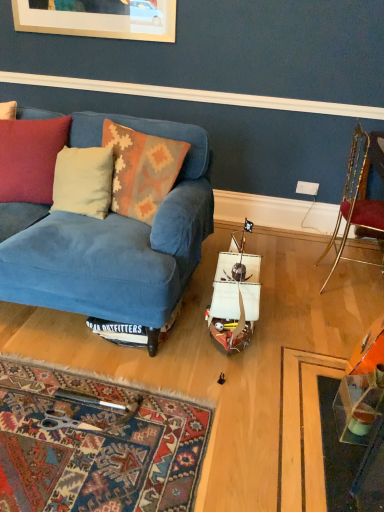
Question: Is velvet cushion at left taller or shorter than white plastic power outlet at center?

Choices:
 (A) tall
 (B) short

Answer: (A)

Question: Is velvet cushion at left inside the boundaries of white plastic power outlet at center, or outside?

Choices:
 (A) outside
 (B) inside

Answer: (A)

Question: Which of these objects is positioned farthest from the transparent plastic table at lower right?

Choices:
 (A) knitted wool pillow at center, acting as the 1th pillow starting from the right
 (B) blue velvet couch at center
 (C) beige fabric pillow at left, which ranks as the 2th pillow in right-to-left order
 (D) white plastic power outlet at center
 (E) gold metallic chair at right

Answer: (D)

Question: Which object is the closest to the knitted wool pillow at center, which is counted as the 2th pillow, starting from the left?

Choices:
 (A) beige fabric pillow at left, which ranks as the 2th pillow in right-to-left order
 (B) white plastic power outlet at center
 (C) gold metallic chair at right
 (D) blue velvet couch at center
 (E) transparent plastic table at lower right

Answer: (A)